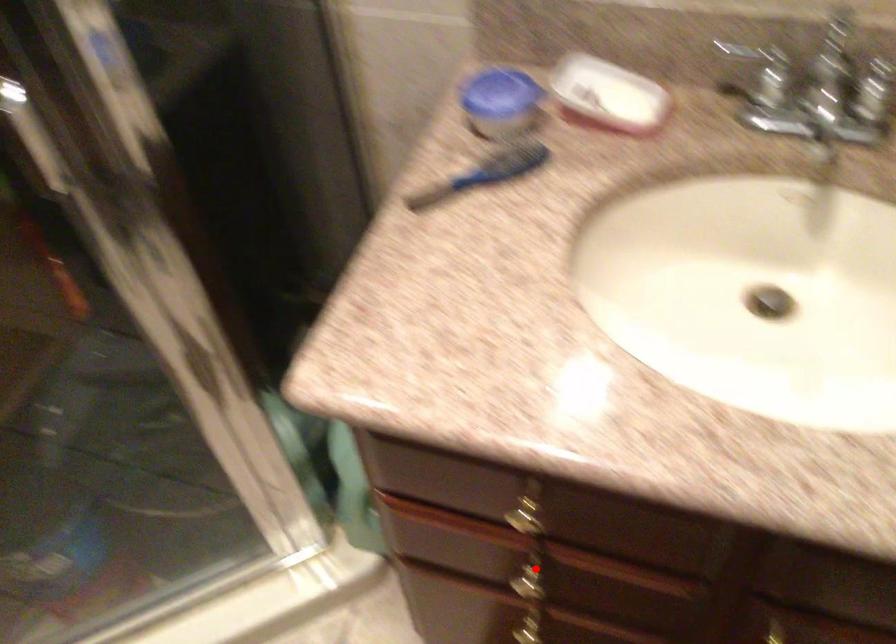
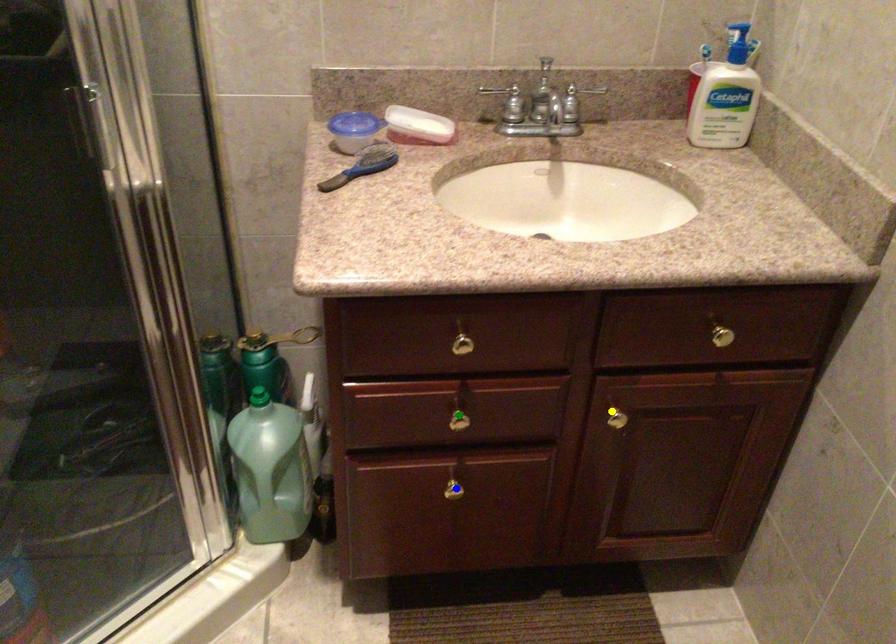
Question: I am providing you with two images of the same scene from different viewpoints. A red point is marked on the first image. You are given multiple points on the second image. Which mark in image 2 goes with the point in image 1?

Choices:
 (A) yellow point
 (B) blue point
 (C) green point

Answer: (C)